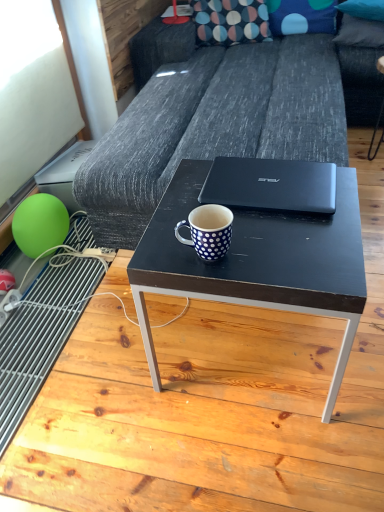
Where is `free space to the right of blue dotted mug at center`? Image resolution: width=384 pixels, height=512 pixels. free space to the right of blue dotted mug at center is located at coordinates (278, 247).